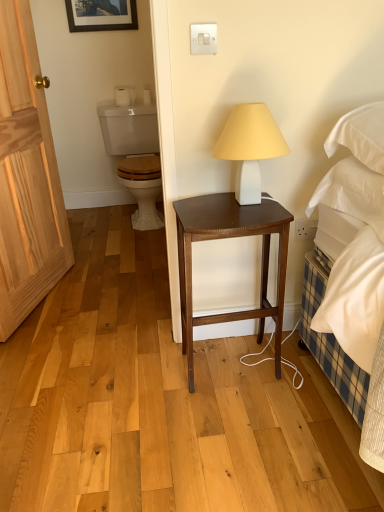
Question: Considering the positions of point (307, 237) and point (306, 212), is point (307, 237) closer or farther from the camera than point (306, 212)?

Choices:
 (A) farther
 (B) closer

Answer: (A)

Question: Considering the positions of white plastic power outlet at lower right and white soft pillow at right in the image, is white plastic power outlet at lower right taller or shorter than white soft pillow at right?

Choices:
 (A) tall
 (B) short

Answer: (B)

Question: Which of these objects is positioned closest to the matte black picture frame at upper center?

Choices:
 (A) white matte lamp at center
 (B) white glossy toilet at upper left
 (C) natural wood door at left
 (D) white plastic power outlet at lower right
 (E) white soft pillow at right

Answer: (B)

Question: Considering the real-world distances, which object is farthest from the white matte toilet paper at upper left?

Choices:
 (A) matte black picture frame at upper center
 (B) white glossy toilet at upper left
 (C) white matte lamp at center
 (D) white soft pillow at right
 (E) natural wood door at left

Answer: (D)